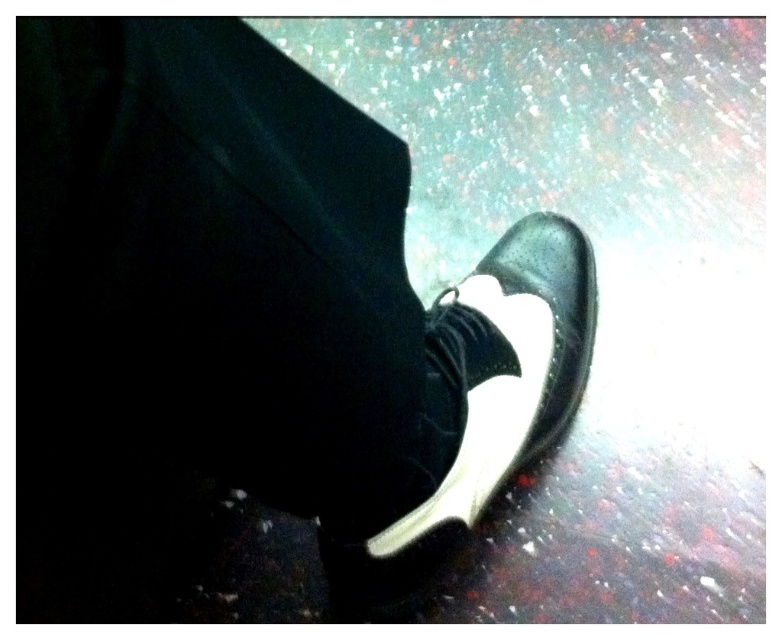
Question: Among these points, which one is nearest to the camera?

Choices:
 (A) (415, 548)
 (B) (76, 131)

Answer: (B)

Question: Can you confirm if black leather shoe at lower right is positioned below matte black shoe at center?

Choices:
 (A) no
 (B) yes

Answer: (B)

Question: Is black leather shoe at lower right below matte black shoe at center?

Choices:
 (A) yes
 (B) no

Answer: (A)

Question: Which point is farther to the camera?

Choices:
 (A) (425, 445)
 (B) (506, 371)

Answer: (B)

Question: Is black leather shoe at lower right positioned in front of matte black shoe at center?

Choices:
 (A) no
 (B) yes

Answer: (B)